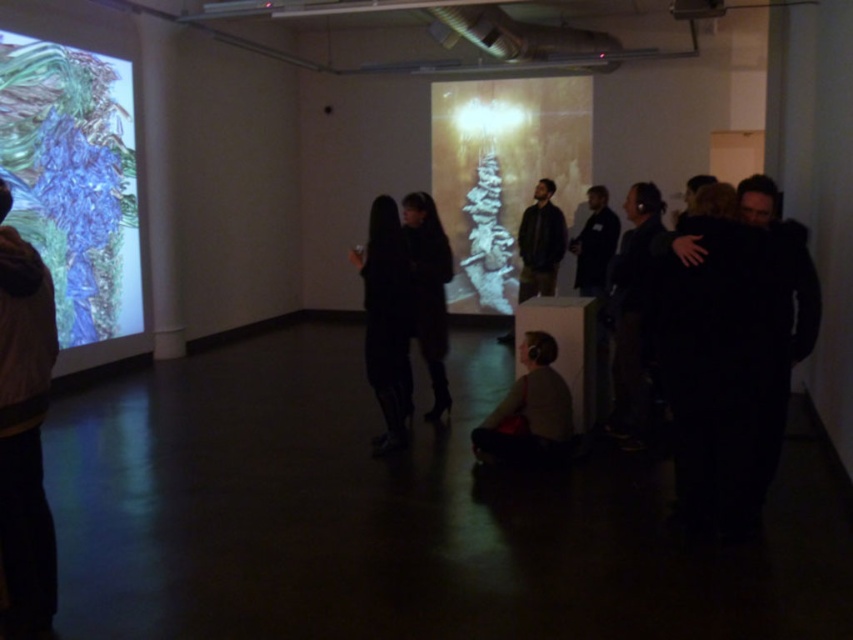
Question: Which point is farther from the camera taking this photo?

Choices:
 (A) (587, 257)
 (B) (526, 404)
 (C) (433, 412)
 (D) (25, 288)

Answer: (A)

Question: Which is nearer to the dark gray sweater at lower center?

Choices:
 (A) dark blue jacket at center
 (B) black matte jacket at right
 (C) dark matte clothing at center

Answer: (C)

Question: Does black matte jacket at right lie behind black leather boots at center?

Choices:
 (A) yes
 (B) no

Answer: (B)

Question: Does black matte jacket at right come behind dark hair at right?

Choices:
 (A) no
 (B) yes

Answer: (A)

Question: Among these points, which one is farthest from the camera?

Choices:
 (A) (492, 458)
 (B) (643, 408)
 (C) (584, 230)
 (D) (387, 385)

Answer: (C)

Question: Is black matte jacket at right below dark hair at right?

Choices:
 (A) no
 (B) yes

Answer: (B)